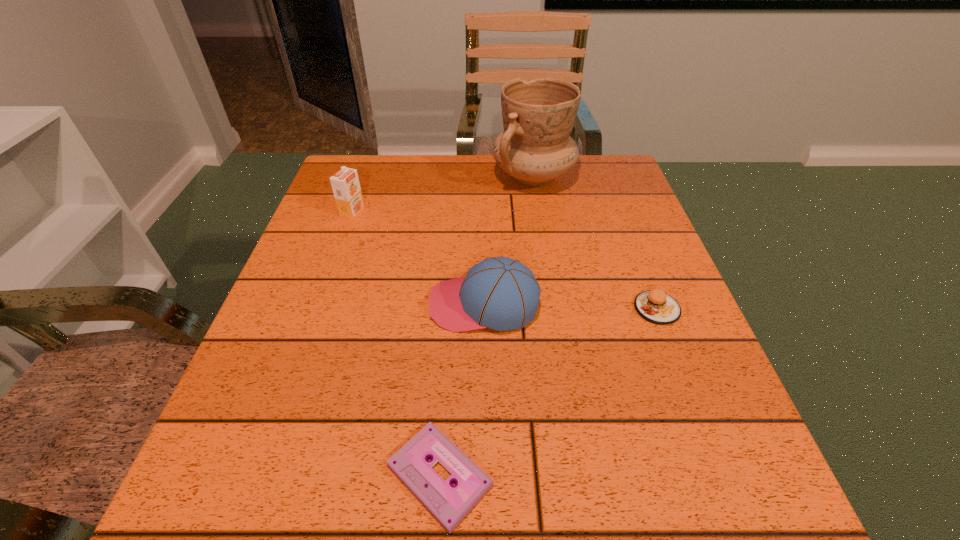
This screenshot has height=540, width=960. Find the location of `the farthest object`. the farthest object is located at coordinates (535, 147).

Identify the location of the tallest object. (535, 147).

The width and height of the screenshot is (960, 540). I want to click on orange juice, so click(345, 184).

I want to click on the leftmost object, so click(x=345, y=184).

Where is `baseball cap`? Image resolution: width=960 pixels, height=540 pixels. baseball cap is located at coordinates (500, 293).

Find the location of a particular element. Image resolution: width=960 pixels, height=540 pixels. patty is located at coordinates (655, 306).

Find the location of a particular element. The height and width of the screenshot is (540, 960). the fourth tallest object is located at coordinates (655, 306).

Identify the location of videotape. The height and width of the screenshot is (540, 960). pos(449,504).

This screenshot has height=540, width=960. Find the location of `the nearest object`. the nearest object is located at coordinates (449, 504).

Identify the location of vacant space located 0.360m on the left of the tallest object. (361, 176).